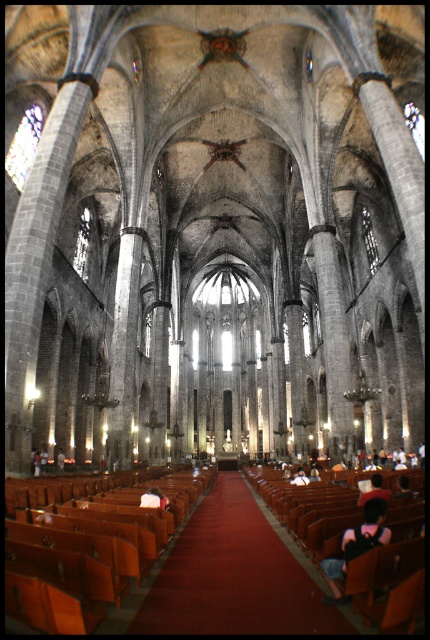
Question: Which object is positioned closest to the stained glass window at left?

Choices:
 (A) transparent glass window at upper right
 (B) wooden polished bench at center
 (C) wooden polished chair at center

Answer: (B)

Question: Can you confirm if wooden polished bench at center is wider than transparent glass window at center?

Choices:
 (A) no
 (B) yes

Answer: (B)

Question: Which point appears farthest from the camera in this image?

Choices:
 (A) (423, 138)
 (B) (374, 253)
 (C) (86, 246)

Answer: (C)

Question: Is stained glass window at left to the right of transparent glass window at upper right from the viewer's perspective?

Choices:
 (A) yes
 (B) no

Answer: (B)

Question: Is transparent glass window at upper center smaller than transparent glass window at upper right?

Choices:
 (A) no
 (B) yes

Answer: (B)

Question: Which point is farther from the camera taking this photo?

Choices:
 (A) (362, 227)
 (B) (85, 262)
 (C) (58, 600)

Answer: (A)